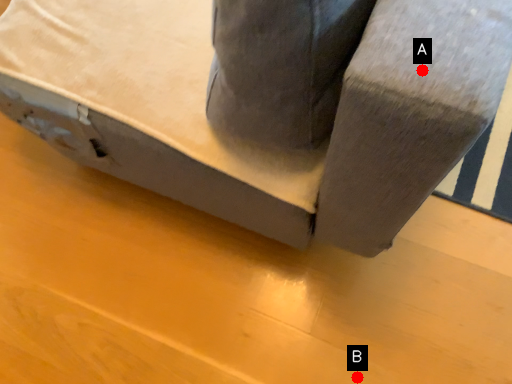
Question: Two points are circled on the image, labeled by A and B beside each circle. Which point appears farthest from the camera in this image?

Choices:
 (A) A is further
 (B) B is further

Answer: (B)